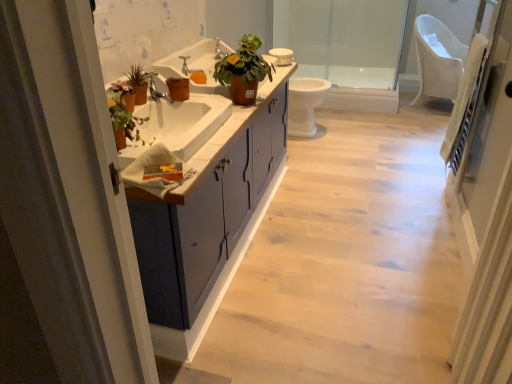
The width and height of the screenshot is (512, 384). What are the coordinates of `free spot above matte gray cabinet at center (from a real-world perspective)` in the screenshot? It's located at (251, 216).